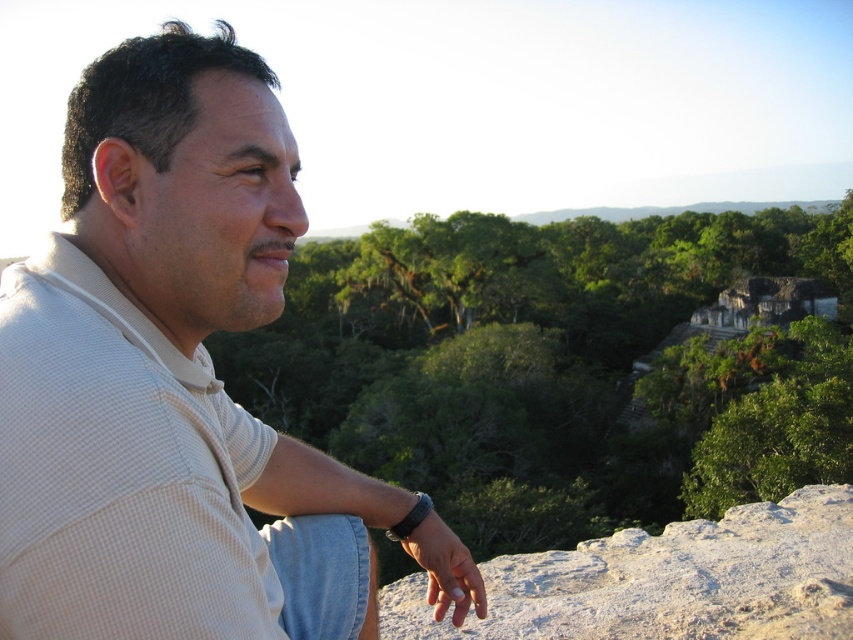
Question: Where is white textured shirt at upper left located in relation to black leather watch at lower center in the image?

Choices:
 (A) left
 (B) right

Answer: (A)

Question: Observing the image, what is the correct spatial positioning of white textured shirt at upper left in reference to white rough stone at center?

Choices:
 (A) below
 (B) above

Answer: (B)

Question: Which of the following is the farthest from the observer?

Choices:
 (A) (550, 582)
 (B) (45, 381)
 (C) (746, 308)
 (D) (440, 586)

Answer: (C)

Question: Among these objects, which one is farthest from the camera?

Choices:
 (A) white rough stone at center
 (B) green leafy trees at center
 (C) white textured shirt at upper left

Answer: (A)

Question: Which object is the closest to the white textured shirt at upper left?

Choices:
 (A) white rough stone at center
 (B) black leather watch at lower center

Answer: (B)

Question: Is green leafy trees at center further to camera compared to black leather watch at lower center?

Choices:
 (A) yes
 (B) no

Answer: (B)